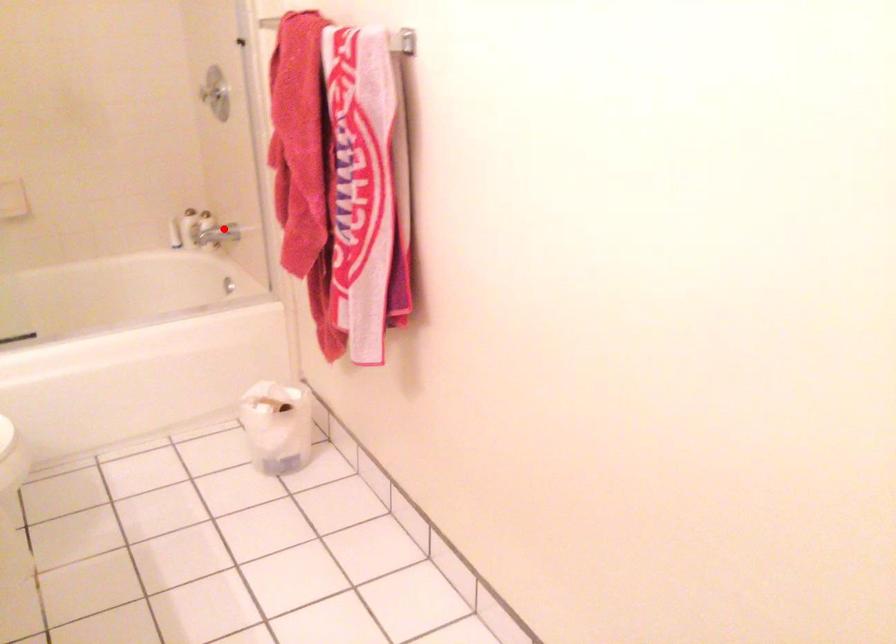
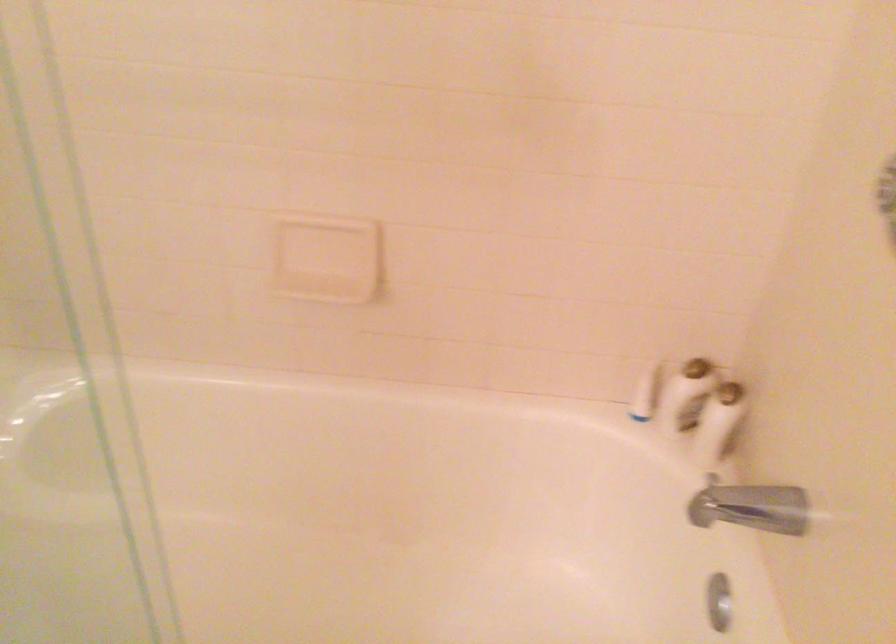
Locate, in the second image, the point that corresponds to the highlighted location in the first image.

(757, 507)